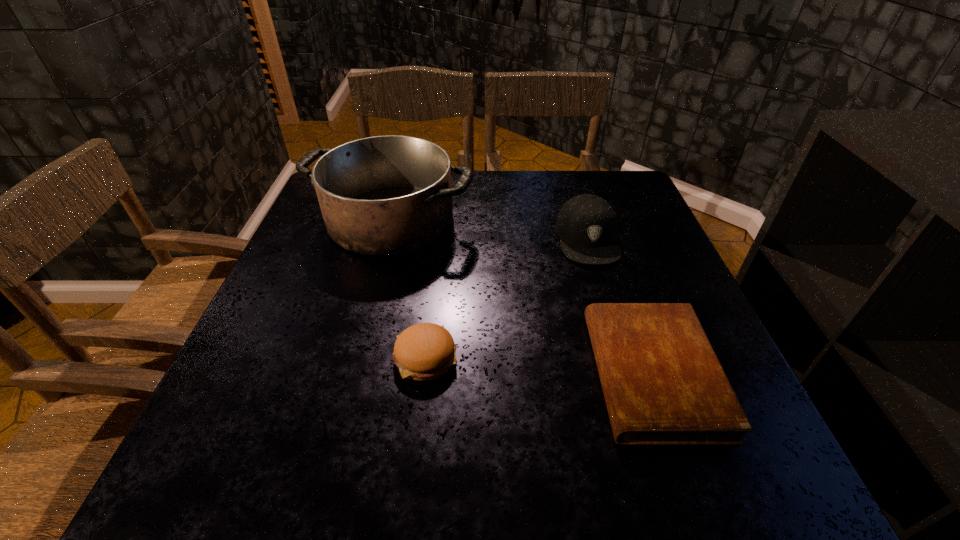
This screenshot has height=540, width=960. I want to click on vacant area at the near edge of the desktop, so click(554, 442).

Locate an element on the screen. The image size is (960, 540). free spot at the left edge of the desktop is located at coordinates (256, 429).

Image resolution: width=960 pixels, height=540 pixels. Identify the location of free space at the right edge. (631, 284).

You are a GUI agent. You are given a task and a screenshot of the screen. Output one action in this format:
    pyautogui.click(x=<x>, y=<y>)
    Task: Click on the free point between the saucepan and the shortest object
    This screenshot has width=960, height=540.
    Given the screenshot: What is the action you would take?
    pyautogui.click(x=521, y=296)

Locate an element on the screen. The height and width of the screenshot is (540, 960). vacant space that is in between the third tallest object and the cap is located at coordinates (507, 298).

Find the location of a particular element. This screenshot has width=960, height=540. vacant area that lies between the patty and the Bible is located at coordinates (540, 366).

The height and width of the screenshot is (540, 960). Identify the location of free space between the saucepan and the third tallest object. (408, 288).

Locate an element on the screen. empty space between the shortest object and the second shortest object is located at coordinates (540, 366).

I want to click on blank region between the tallest object and the shortest object, so click(521, 296).

Where is `free spot between the Bible and the second shortest object`? Image resolution: width=960 pixels, height=540 pixels. free spot between the Bible and the second shortest object is located at coordinates 540,366.